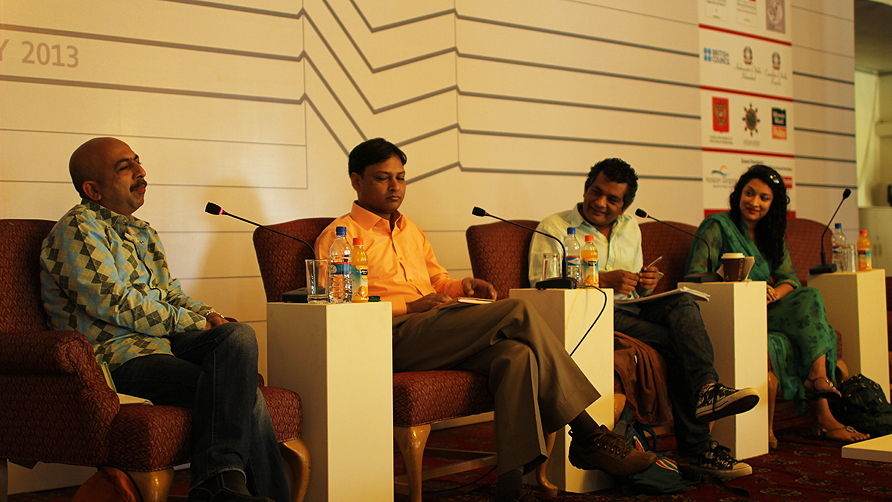
You are a GUI agent. You are given a task and a screenshot of the screen. Output one action in this format:
    pyautogui.click(x=<x>, y=<y>)
    Task: Click on the 1 empty chair
    
    Given the screenshot: What is the action you would take?
    pyautogui.click(x=794, y=224)